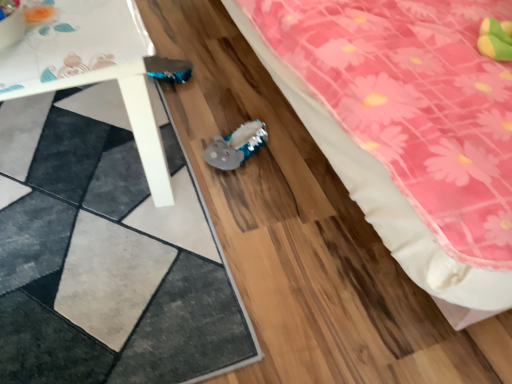
Find the location of `vacant space positioned to the left of fuzzy fabric plushie at center`. vacant space positioned to the left of fuzzy fabric plushie at center is located at coordinates (178, 149).